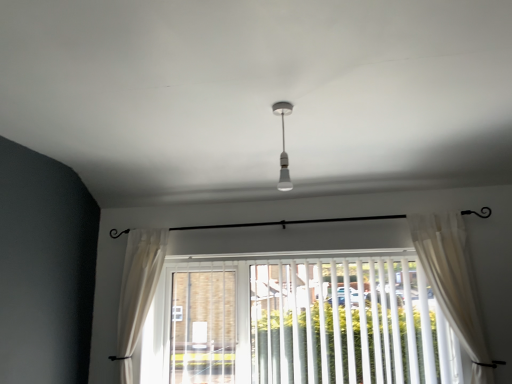
Question: From a real-world perspective, is white sheer curtain at right, which appears as the 1th curtain when viewed from the front, over white glossy bulb at center?

Choices:
 (A) yes
 (B) no

Answer: (B)

Question: Is white sheer curtain at right, which appears as the 1th curtain when viewed from the front, at the left side of white glossy bulb at center?

Choices:
 (A) yes
 (B) no

Answer: (B)

Question: Is white sheer curtain at right, which is the 1th curtain in right-to-left order, wider than white glossy bulb at center?

Choices:
 (A) no
 (B) yes

Answer: (B)

Question: Is white sheer curtain at right, which is the 1th curtain in right-to-left order, at the right side of white glossy bulb at center?

Choices:
 (A) no
 (B) yes

Answer: (B)

Question: From a real-world perspective, is white sheer curtain at right, which ranks as the second curtain in left-to-right order, physically below white glossy bulb at center?

Choices:
 (A) yes
 (B) no

Answer: (A)

Question: Is white plastic blinds at center in front of or behind white sheer curtain at right, the second curtain when ordered from back to front, in the image?

Choices:
 (A) front
 (B) behind

Answer: (B)

Question: Is point (283, 269) positioned closer to the camera than point (419, 261)?

Choices:
 (A) closer
 (B) farther

Answer: (B)

Question: Would you say white plastic blinds at center is to the left or to the right of white sheer curtain at right, which is the 1th curtain in right-to-left order, in the picture?

Choices:
 (A) right
 (B) left

Answer: (B)

Question: From their relative heights in the image, would you say white plastic blinds at center is taller or shorter than white sheer curtain at right, which appears as the 1th curtain when viewed from the front?

Choices:
 (A) short
 (B) tall

Answer: (A)

Question: Looking at the image, does white glossy bulb at center seem bigger or smaller compared to white sheer curtain at right, which ranks as the second curtain in left-to-right order?

Choices:
 (A) small
 (B) big

Answer: (A)

Question: Looking at their shapes, would you say white glossy bulb at center is wider or thinner than white sheer curtain at right, which ranks as the second curtain in left-to-right order?

Choices:
 (A) thin
 (B) wide

Answer: (A)

Question: In the image, is white glossy bulb at center positioned in front of or behind white sheer curtain at right, which appears as the 1th curtain when viewed from the front?

Choices:
 (A) behind
 (B) front

Answer: (B)

Question: Choose the correct answer: Is white glossy bulb at center inside white sheer curtain at right, which is the 1th curtain in right-to-left order, or outside it?

Choices:
 (A) outside
 (B) inside

Answer: (A)

Question: From a real-world perspective, is white sheer curtain at lower center, arranged as the 2th curtain when viewed from the front, physically located above or below white plastic blinds at center?

Choices:
 (A) above
 (B) below

Answer: (A)

Question: Is white sheer curtain at lower center, arranged as the 2th curtain when viewed from the front, in front of or behind white plastic blinds at center in the image?

Choices:
 (A) front
 (B) behind

Answer: (B)